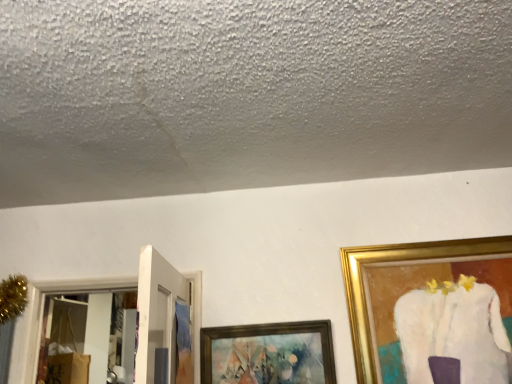
You are a GUI agent. You are given a task and a screenshot of the screen. Output one action in this format:
    pyautogui.click(x=<x>, y=<y>)
    Task: Click on the wooden picture frame at lower center
    Image resolution: width=512 pixels, height=384 pixels.
    Given the screenshot: What is the action you would take?
    pyautogui.click(x=269, y=353)

Describe the element at coordinates (269, 353) in the screenshot. The image size is (512, 384). I see `wooden picture frame at lower center` at that location.

Measure the distance between wooden picture frame at lower center and camera.

wooden picture frame at lower center and camera are 1.79 meters apart.

Find the location of a particular element. The width and height of the screenshot is (512, 384). wooden picture frame at lower center is located at coordinates (269, 353).